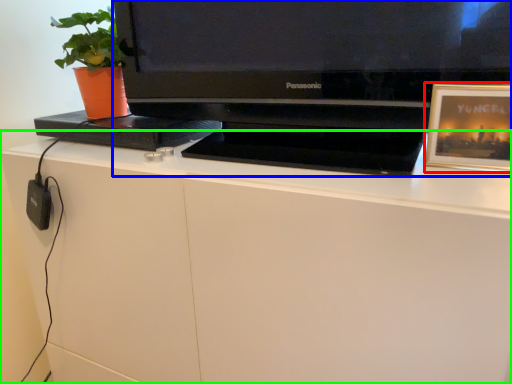
Question: Considering the real-world distances, which object is farthest from picture frame (highlighted by a red box)? television (highlighted by a blue box) or desk (highlighted by a green box)?

Choices:
 (A) television
 (B) desk

Answer: (B)